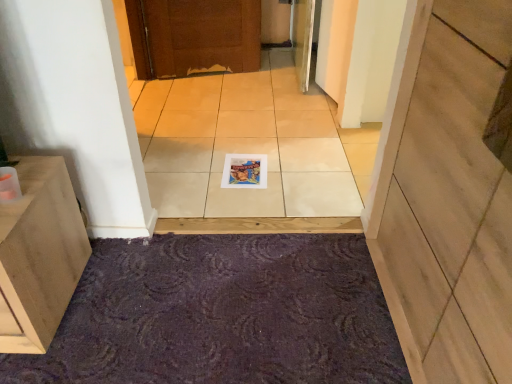
Question: Is wooden at center bigger than white glossy tile at center?

Choices:
 (A) no
 (B) yes

Answer: (B)

Question: Can you confirm if wooden at center is shorter than white glossy tile at center?

Choices:
 (A) no
 (B) yes

Answer: (A)

Question: Could you tell me if wooden at center is turned towards white glossy tile at center?

Choices:
 (A) no
 (B) yes

Answer: (A)

Question: Considering the relative sizes of wooden at center and white glossy tile at center in the image provided, is wooden at center wider than white glossy tile at center?

Choices:
 (A) no
 (B) yes

Answer: (A)

Question: Is the position of wooden at center more distant than that of white glossy tile at center?

Choices:
 (A) yes
 (B) no

Answer: (B)

Question: Considering the positions of white glossy tile at center and purple textured bath mat at lower center in the image, is white glossy tile at center taller or shorter than purple textured bath mat at lower center?

Choices:
 (A) tall
 (B) short

Answer: (B)

Question: Is white glossy tile at center in front of or behind purple textured bath mat at lower center in the image?

Choices:
 (A) front
 (B) behind

Answer: (B)

Question: From the image's perspective, is white glossy tile at center positioned above or below purple textured bath mat at lower center?

Choices:
 (A) below
 (B) above

Answer: (B)

Question: Is point (287, 160) closer or farther from the camera than point (76, 299)?

Choices:
 (A) closer
 (B) farther

Answer: (B)

Question: From the image's perspective, is purple textured bath mat at lower center located above or below white glossy tile at center?

Choices:
 (A) below
 (B) above

Answer: (A)

Question: Choose the correct answer: Is purple textured bath mat at lower center inside white glossy tile at center or outside it?

Choices:
 (A) outside
 (B) inside

Answer: (A)

Question: Based on their sizes in the image, would you say purple textured bath mat at lower center is bigger or smaller than white glossy tile at center?

Choices:
 (A) small
 (B) big

Answer: (A)

Question: Does point (133, 276) appear closer or farther from the camera than point (344, 188)?

Choices:
 (A) closer
 (B) farther

Answer: (A)

Question: In terms of height, does matte paper magazine at center look taller or shorter compared to white glossy tile at center?

Choices:
 (A) short
 (B) tall

Answer: (B)

Question: Does point (254, 183) appear closer or farther from the camera than point (269, 177)?

Choices:
 (A) farther
 (B) closer

Answer: (B)